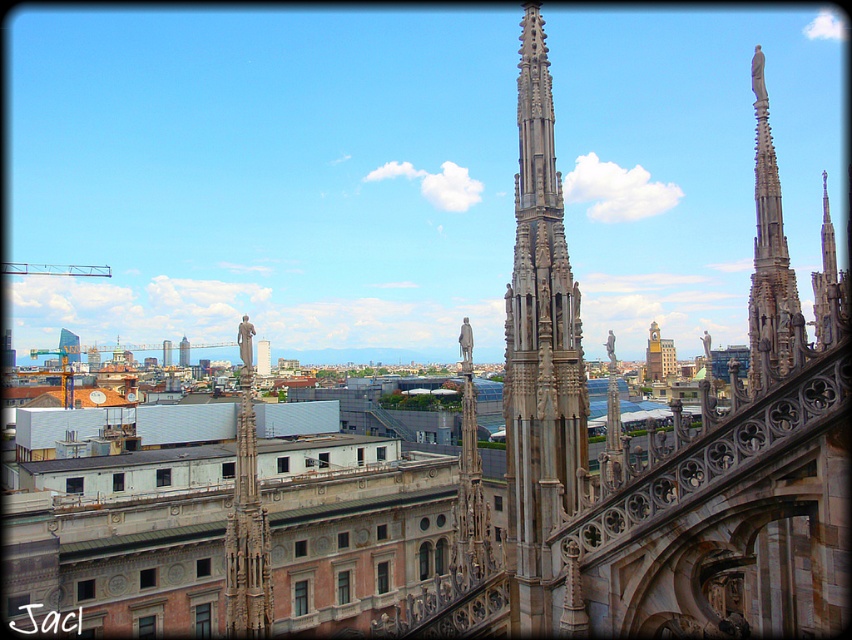
Is matte gray tower at center further to the viewer compared to matte gray skyscraper at center?

Yes, it is.

Between point (183, 342) and point (165, 355), which one is positioned in front?

Point (183, 342) is in front.

Who is more forward, (186, 355) or (170, 358)?

Positioned in front is point (186, 355).

At what (x,y) coordinates should I click in order to perform the action: click on matte gray tower at center. Please return your answer as a coordinate pair (x, y). Looking at the image, I should click on (183, 353).

Who is taller, stone spire at center or matte gray tower at center?

stone spire at center

Does point (524, 504) come behind point (179, 342)?

That is False.

Which is in front, point (547, 291) or point (185, 340)?

Point (547, 291) is in front.

Image resolution: width=852 pixels, height=640 pixels. What are the coordinates of `stone spire at center` in the screenshot? It's located at (539, 353).

Is white matte building at center above stone statue at center?

No.

In the scene shown: Is white matte building at center bigger than stone statue at center?

Correct, white matte building at center is larger in size than stone statue at center.

Identify the location of white matte building at center. The height and width of the screenshot is (640, 852). (139, 467).